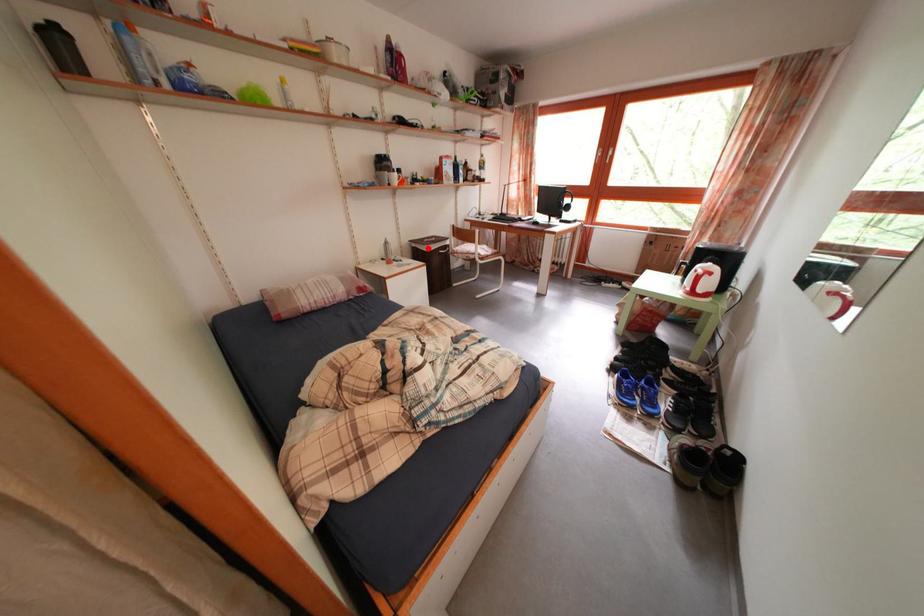
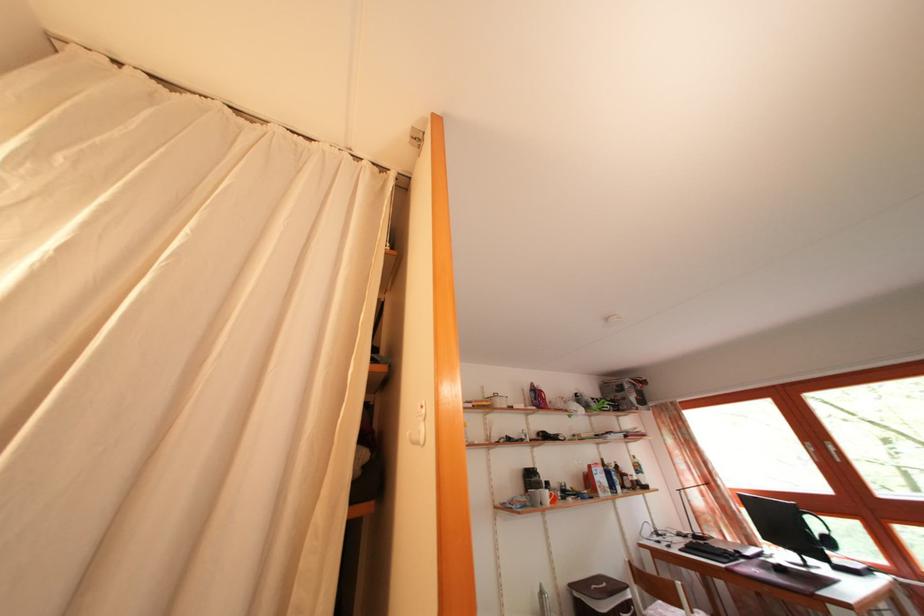
Locate, in the second image, the point that corresponds to the highlighted location in the first image.

(592, 594)